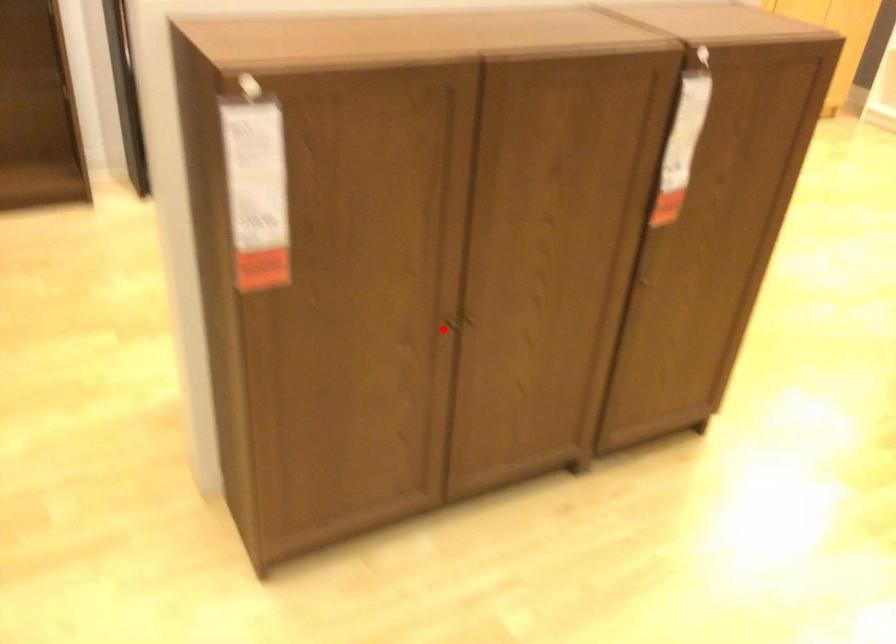
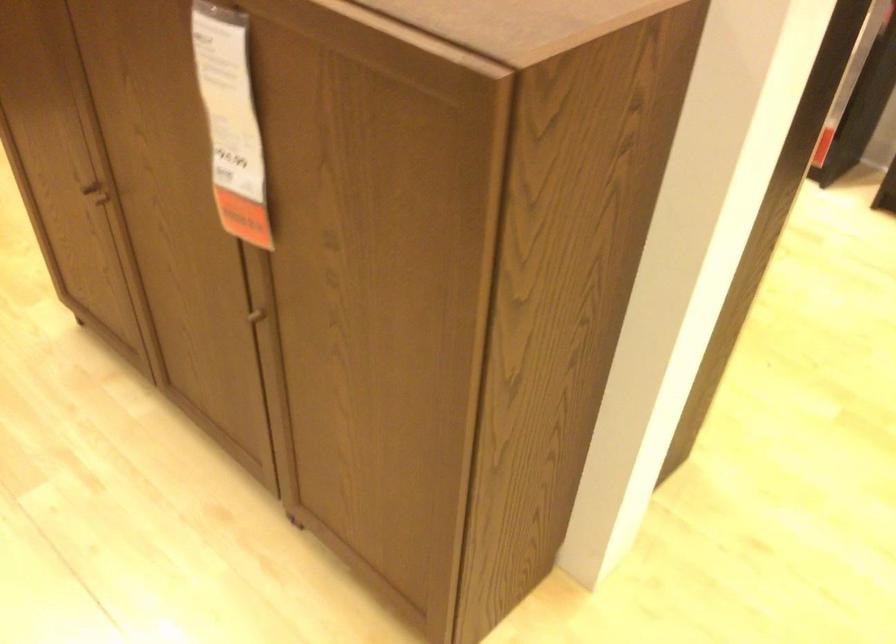
Find the pixel in the second image that matches the highlighted location in the first image.

(95, 196)